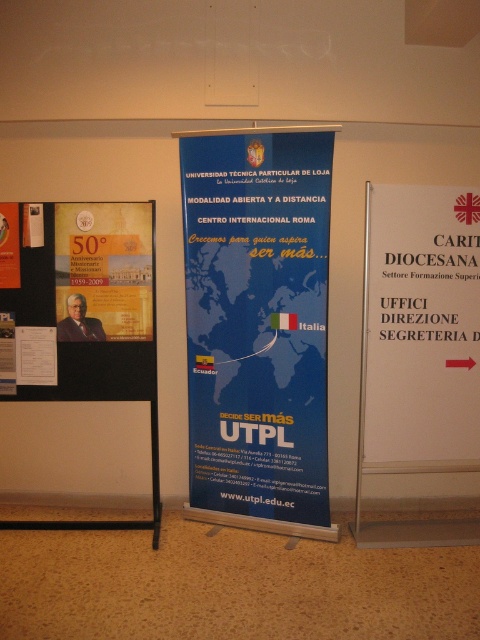
Which is below, matte gold paper at left or matte gold poster at left?

matte gold paper at left

Is point (100, 380) farther from viewer compared to point (11, 204)?

Yes, point (100, 380) is farther from viewer.

Find the location of a particular element. Image resolution: width=480 pixels, height=640 pixels. matte gold paper at left is located at coordinates (76, 301).

Does point (428, 208) come behind point (39, 292)?

No.

Which is in front, point (432, 349) or point (12, 352)?

Positioned in front is point (432, 349).

At what (x,y) coordinates should I click in order to perform the action: click on white paper sign at right. Please return your answer as a coordinate pair (x, y). This screenshot has height=640, width=480. Looking at the image, I should click on (420, 330).

Describe the element at coordinates (257, 326) in the screenshot. I see `blue paperboard poster at center` at that location.

Between blue paperboard poster at center and white paper sign at right, which one is positioned higher?

white paper sign at right is above.

Locate an element on the screen. blue paperboard poster at center is located at coordinates (257, 326).

Locate an element on the screen. Image resolution: width=480 pixels, height=640 pixels. blue paperboard poster at center is located at coordinates click(x=257, y=326).